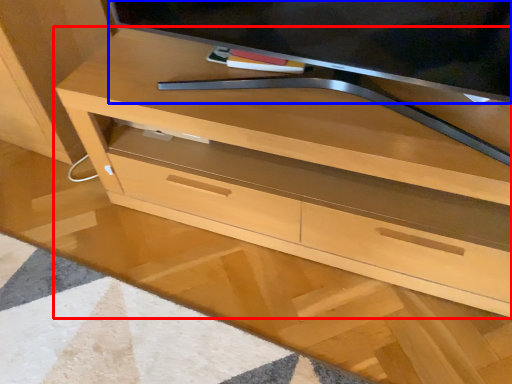
Question: Among these objects, which one is nearest to the camera, chest of drawers (highlighted by a red box) or television (highlighted by a blue box)?

Choices:
 (A) chest of drawers
 (B) television

Answer: (B)